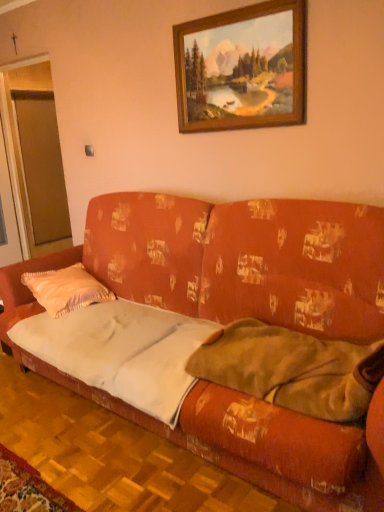
Locate an element on the screen. This screenshot has width=384, height=512. free area below wooden picture frame at upper center (from a real-world perspective) is located at coordinates (235, 178).